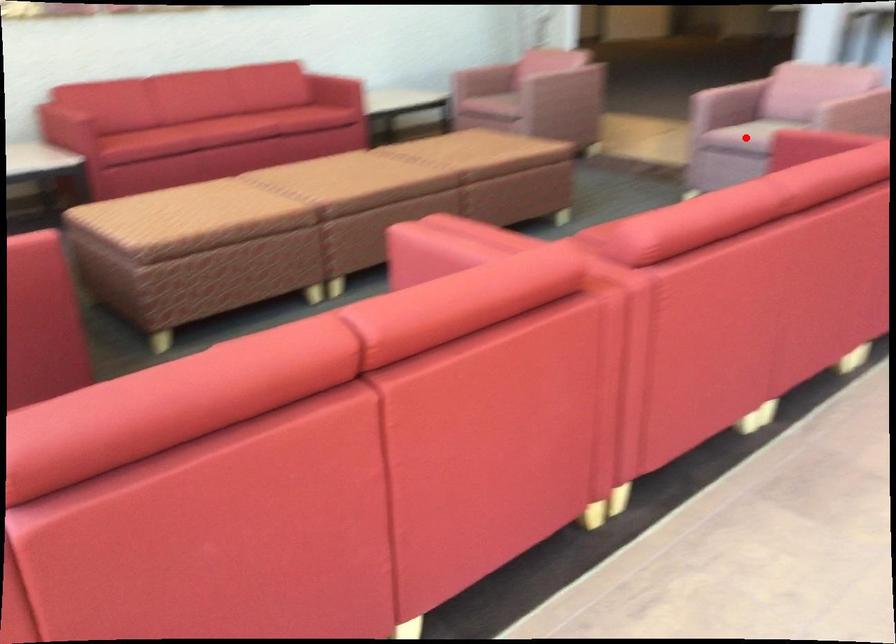
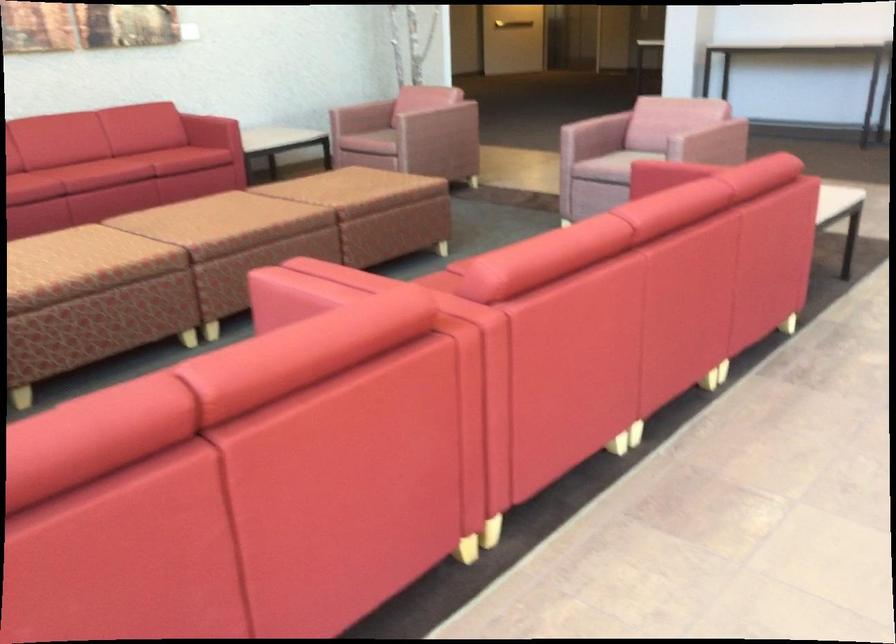
In the second image, find the point that corresponds to the highlighted location in the first image.

(615, 166)